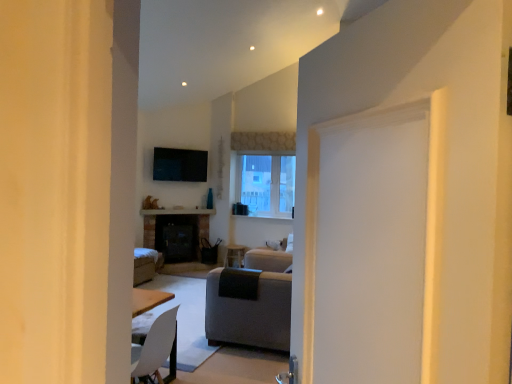
Question: From the image's perspective, is gray fabric couch at center below clear glass window at center?

Choices:
 (A) no
 (B) yes

Answer: (B)

Question: Is gray fabric couch at center far away from clear glass window at center?

Choices:
 (A) no
 (B) yes

Answer: (B)

Question: Is gray fabric couch at center outside clear glass window at center?

Choices:
 (A) yes
 (B) no

Answer: (A)

Question: Is gray fabric couch at center wider than clear glass window at center?

Choices:
 (A) yes
 (B) no

Answer: (A)

Question: Is clear glass window at center at the back of gray fabric couch at center?

Choices:
 (A) yes
 (B) no

Answer: (B)

Question: From a real-world perspective, does gray fabric couch at center sit lower than clear glass window at center?

Choices:
 (A) no
 (B) yes

Answer: (B)

Question: Is clear glass window at center further to the viewer compared to gray fabric couch at center?

Choices:
 (A) yes
 (B) no

Answer: (A)

Question: From a real-world perspective, is clear glass window at center positioned under gray fabric couch at center based on gravity?

Choices:
 (A) yes
 (B) no

Answer: (B)

Question: Does clear glass window at center lie in front of gray fabric couch at center?

Choices:
 (A) no
 (B) yes

Answer: (A)

Question: Does clear glass window at center have a greater width compared to gray fabric couch at center?

Choices:
 (A) yes
 (B) no

Answer: (B)

Question: Is gray fabric couch at center located within clear glass window at center?

Choices:
 (A) yes
 (B) no

Answer: (B)

Question: Is clear glass window at center to the left of gray fabric couch at center from the viewer's perspective?

Choices:
 (A) yes
 (B) no

Answer: (B)

Question: From a real-world perspective, is gray fabric couch at center positioned above or below clear glass window at center?

Choices:
 (A) above
 (B) below

Answer: (B)